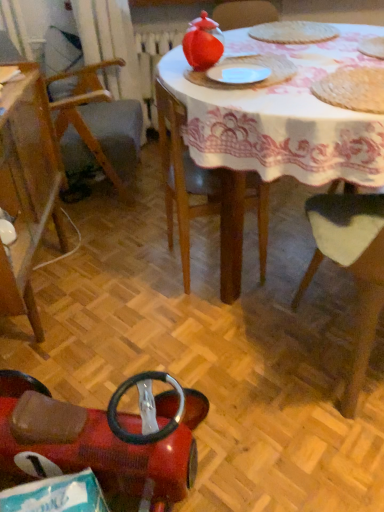
I want to click on vacant space in between white matte paper plate at center and white textured placemat at upper center, placed as the 2th food when sorted from bottom to top, so click(276, 54).